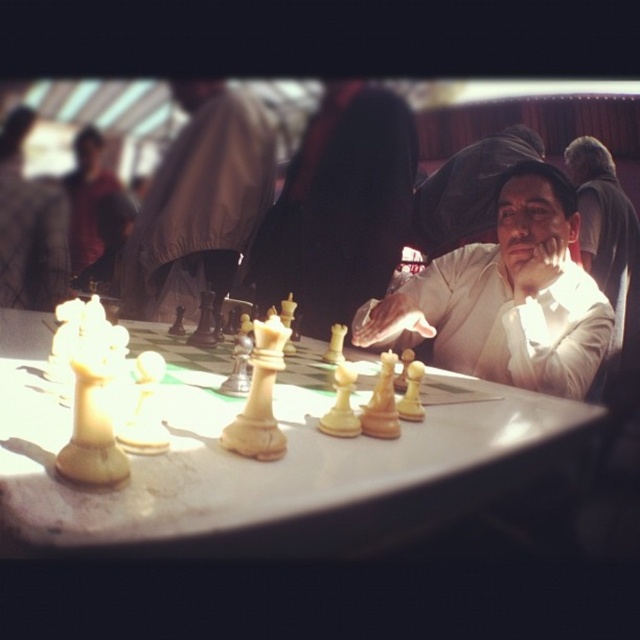
You are a chess player who wants to place a new chess piece on the board. Given the white glossy chessboard at center and the white glossy chess piece at center, can you fit the piece on the board without overlapping?

The white glossy chessboard at center is smaller than the white glossy chess piece at center, so the piece cannot fit on the board without overlapping.

You are standing at the chessboard and want to place a new piece at point (529, 186). Is this point in front of or behind point (637, 225)?

Point (529, 186) is in front of point (637, 225).